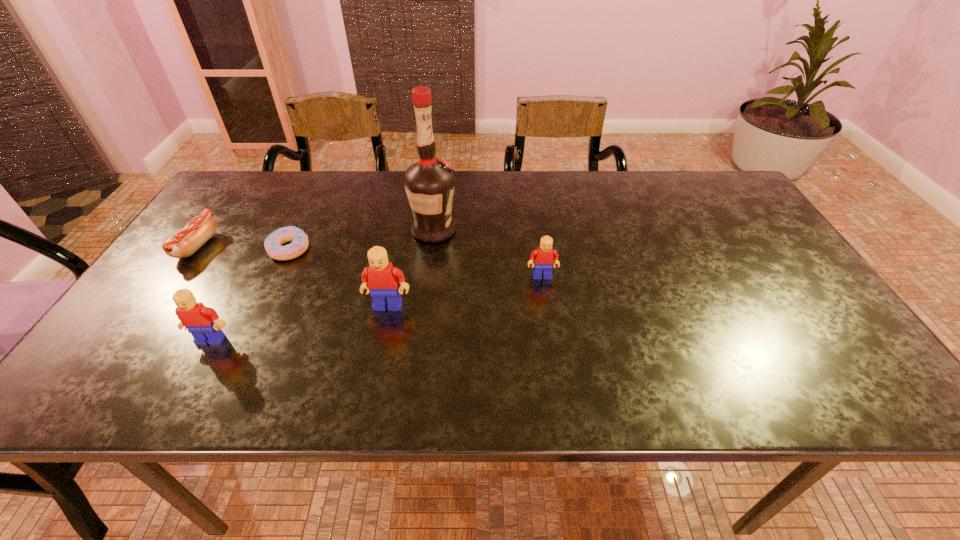
Identify which object is the fifth closest to the doughnut. Please provide its 2D coordinates. Your answer should be formatted as a tuple, i.e. [(x, y)], where the tuple contains the x and y coordinates of a point satisfying the conditions above.

[(545, 257)]

Identify the location of Lego that is the second closest one to the doughnut. The width and height of the screenshot is (960, 540). (203, 323).

Identify the location of Lego that stands as the second closest to the second nearest Lego. Image resolution: width=960 pixels, height=540 pixels. (545, 257).

This screenshot has width=960, height=540. I want to click on blank space that satisfies the following two spatial constraints: 1. on the front and back of the tallest object; 2. on the face of the second farthest Lego, so click(x=424, y=306).

Image resolution: width=960 pixels, height=540 pixels. What are the coordinates of `free space that satisfies the following two spatial constraints: 1. on the front and back of the liquor; 2. on the face of the nearest object` in the screenshot? It's located at (420, 340).

This screenshot has height=540, width=960. I want to click on vacant region that satisfies the following two spatial constraints: 1. on the front and back of the liquor; 2. on the front side of the doughnut, so click(431, 249).